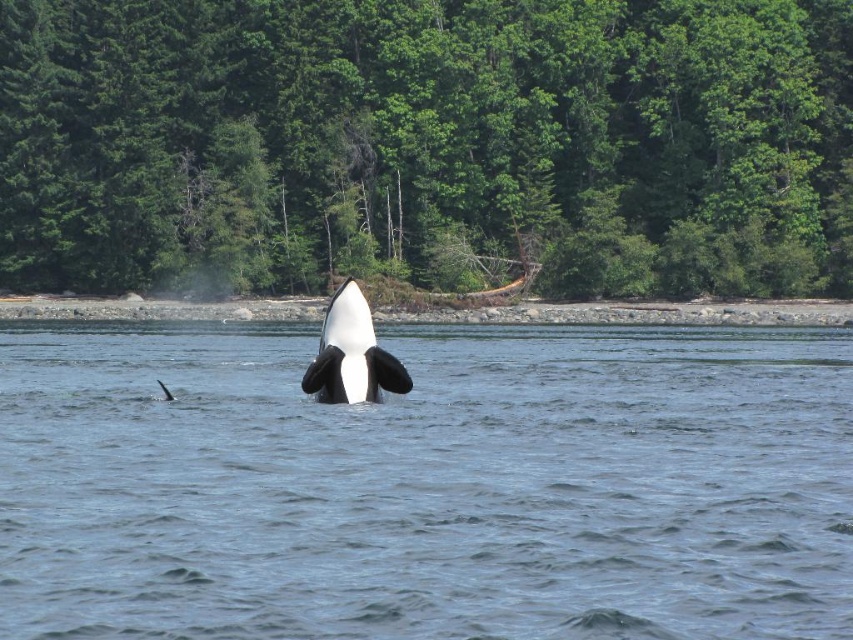
Does clear blue water at center appear on the left side of black/white skin whale at center?

Incorrect, clear blue water at center is not on the left side of black/white skin whale at center.

Describe the element at coordinates (426, 484) in the screenshot. The image size is (853, 640). I see `clear blue water at center` at that location.

This screenshot has width=853, height=640. In order to click on clear blue water at center in this screenshot , I will do `click(426, 484)`.